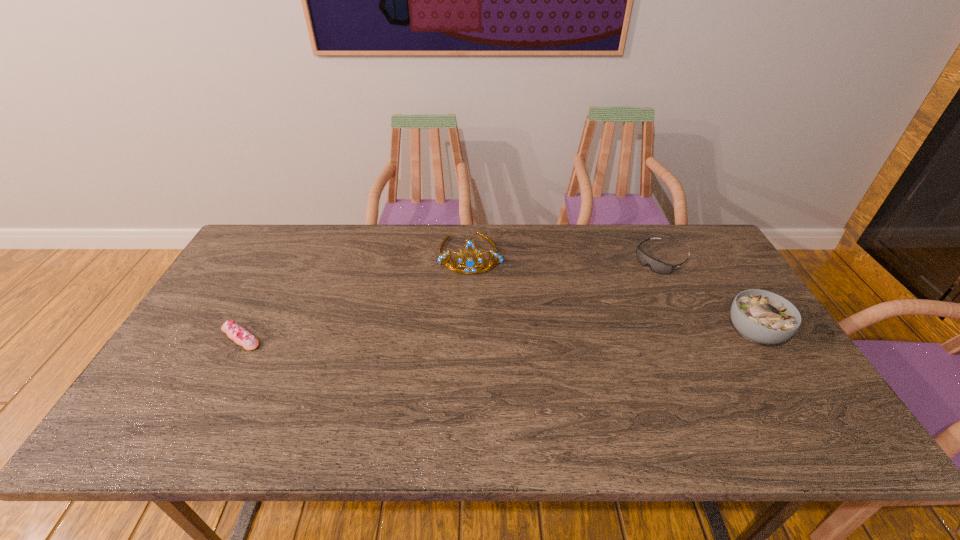
The height and width of the screenshot is (540, 960). Find the location of `free space between the eclair and the second object from left to right`. free space between the eclair and the second object from left to right is located at coordinates (356, 295).

Locate an element on the screen. Image resolution: width=960 pixels, height=540 pixels. vacant space that is in between the third tallest object and the third shortest object is located at coordinates (708, 296).

Image resolution: width=960 pixels, height=540 pixels. Find the location of `free spot between the soup bowl and the tallest object`. free spot between the soup bowl and the tallest object is located at coordinates (612, 293).

Locate an element on the screen. The height and width of the screenshot is (540, 960). unoccupied position between the second tallest object and the tiara is located at coordinates (612, 293).

At what (x,y) coordinates should I click in order to perform the action: click on empty location between the third object from right to left and the soup bowl. Please return your answer as a coordinate pair (x, y). This screenshot has height=540, width=960. Looking at the image, I should click on (612, 293).

The image size is (960, 540). Identify the location of vacant area that lies between the tallest object and the soup bowl. (612, 293).

Point out which object is positioned as the nearest to the second tallest object. Please provide its 2D coordinates. Your answer should be formatted as a tuple, i.e. [(x, y)], where the tuple contains the x and y coordinates of a point satisfying the conditions above.

[(656, 266)]

Locate which object is the third closest to the second object from left to right. Please provide its 2D coordinates. Your answer should be formatted as a tuple, i.e. [(x, y)], where the tuple contains the x and y coordinates of a point satisfying the conditions above.

[(760, 316)]

Locate an element on the screen. The width and height of the screenshot is (960, 540). vacant region that satisfies the following two spatial constraints: 1. on the front side of the tallest object; 2. on the left side of the goggles is located at coordinates (470, 260).